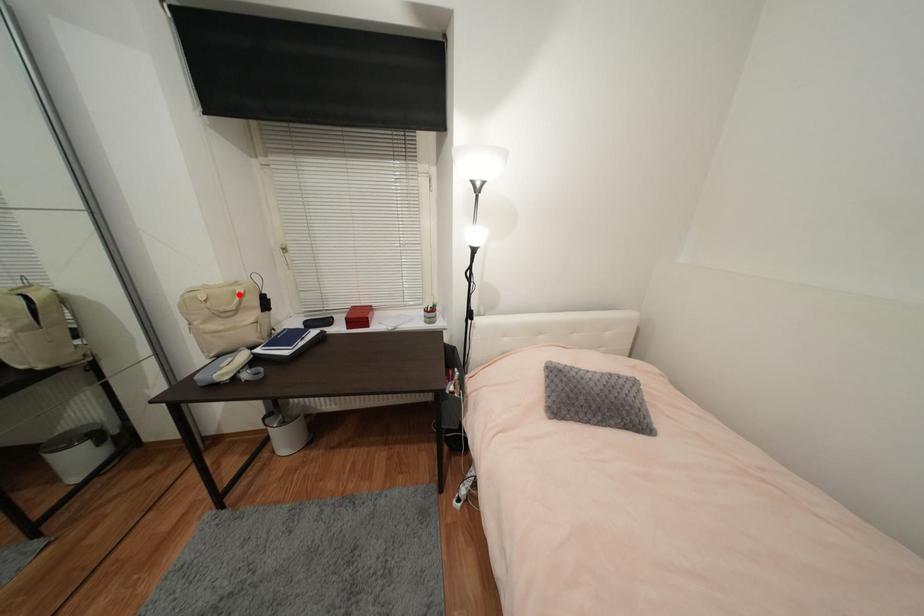
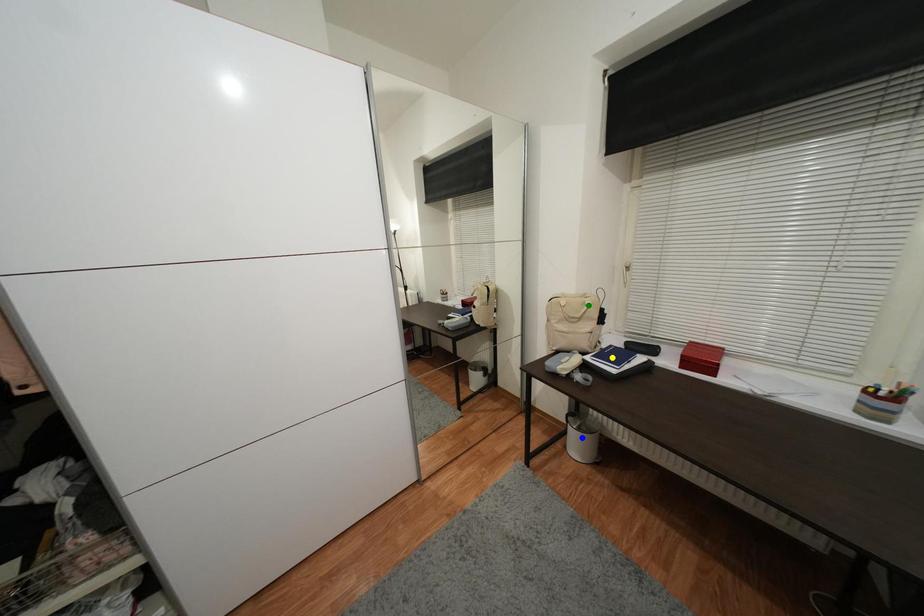
Question: I am providing you with two images of the same scene from different viewpoints. A red point is marked on the first image. You are given multiple points on the second image. In image 2, which mark is for the same physical point as the one in image 1?

Choices:
 (A) green point
 (B) yellow point
 (C) blue point

Answer: (A)